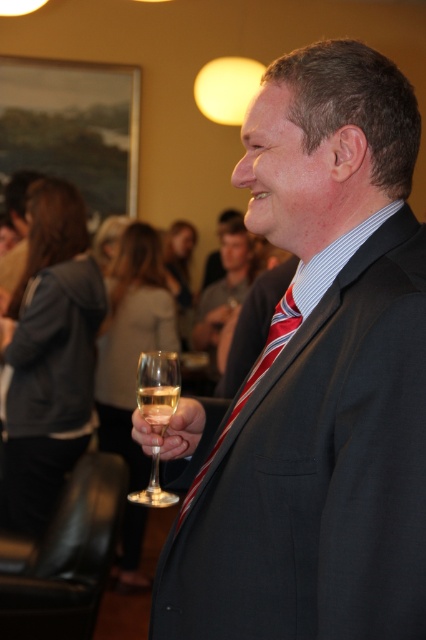
How far apart are clear glass wine glass at center and striped fabric tie at center?

clear glass wine glass at center and striped fabric tie at center are 4.90 inches apart from each other.

In the scene shown: Is clear glass wine glass at center bigger than striped fabric tie at center?

Actually, clear glass wine glass at center might be smaller than striped fabric tie at center.

What do you see at coordinates (158, 387) in the screenshot? I see `clear glass wine glass at center` at bounding box center [158, 387].

Locate an element on the screen. This screenshot has width=426, height=640. clear glass wine glass at center is located at coordinates (158, 387).

Is matte black suit at center wider than clear glass at center?

Correct, the width of matte black suit at center exceeds that of clear glass at center.

This screenshot has width=426, height=640. Identify the location of matte black suit at center. (313, 381).

Locate an element on the screen. matte black suit at center is located at coordinates (313, 381).

Can you confirm if matte black suit at center is smaller than clear glass wine glass at center?

Actually, matte black suit at center might be larger than clear glass wine glass at center.

Which is behind, point (241, 592) or point (167, 413)?

The point (167, 413) is more distant.

The width and height of the screenshot is (426, 640). I want to click on matte black suit at center, so click(313, 381).